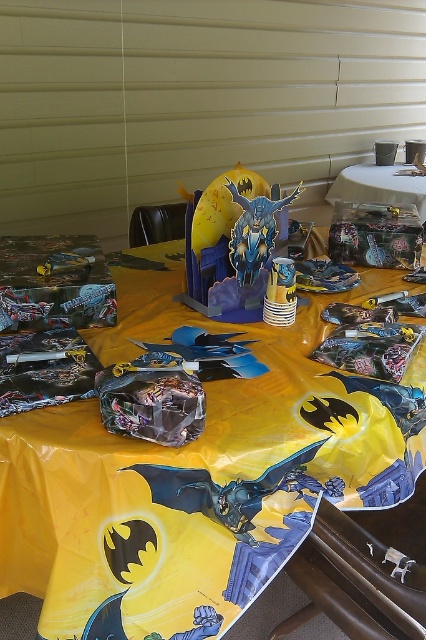
Based on the photo, you are a guest at the Batman party and want to place a cup on the table. Which surface should you use, the yellow plastic tablecloth at center or the clear plastic table at upper center?

You should place the cup on the clear plastic table at upper center because the yellow plastic tablecloth at center is much taller and may not provide a stable surface for the cup.

Consider the image. What is located at the coordinates point (192,476) on the Batman party table?

The yellow plastic tablecloth at center is located at point (192,476).

You are a guest at the Batman party and want to place a cup on the table. Where should you place it so it is closer to the yellow plastic tablecloth at center than the clear plastic table at upper center?

Place the cup to the left side of the yellow plastic tablecloth at center since it is positioned on the left side of the clear plastic table at upper center.